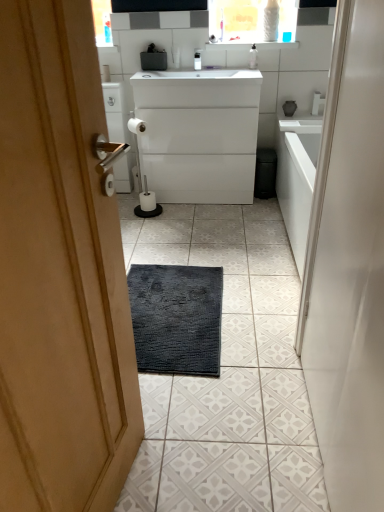
Question: Is transparent plastic bottle at upper center further to the viewer compared to white matte toilet paper at center, the 2th toilet paper from the top?

Choices:
 (A) no
 (B) yes

Answer: (A)

Question: Does transparent plastic bottle at upper center have a greater height compared to white matte toilet paper at center, which is counted as the 1th toilet paper, starting from the right?

Choices:
 (A) no
 (B) yes

Answer: (B)

Question: Is transparent plastic bottle at upper center not inside white matte toilet paper at center, arranged as the 2th toilet paper when viewed from the left?

Choices:
 (A) no
 (B) yes

Answer: (B)

Question: Is transparent plastic bottle at upper center bigger than white matte toilet paper at center, arranged as the 2th toilet paper when viewed from the left?

Choices:
 (A) yes
 (B) no

Answer: (B)

Question: Is transparent plastic bottle at upper center smaller than white matte toilet paper at center, the 2th toilet paper from the top?

Choices:
 (A) yes
 (B) no

Answer: (A)

Question: Is point (188, 83) positioned closer to the camera than point (104, 64)?

Choices:
 (A) farther
 (B) closer

Answer: (B)

Question: From the image's perspective, is white glossy cabinet at center positioned above or below white matte toilet paper at center, which is the second toilet paper from right to left?

Choices:
 (A) above
 (B) below

Answer: (B)

Question: Is white glossy cabinet at center to the left or to the right of white matte toilet paper at center, the 1th toilet paper from the left, in the image?

Choices:
 (A) right
 (B) left

Answer: (A)

Question: Considering the positions of white glossy cabinet at center and white matte toilet paper at center, which is the second toilet paper from right to left, in the image, is white glossy cabinet at center wider or thinner than white matte toilet paper at center, which is the second toilet paper from right to left,?

Choices:
 (A) wide
 (B) thin

Answer: (A)

Question: Relative to white matte toilet paper at center, which is counted as the 1th toilet paper, starting from the right, is white glossy cabinet at center in front or behind?

Choices:
 (A) front
 (B) behind

Answer: (A)

Question: Is point (178, 89) closer or farther from the camera than point (148, 190)?

Choices:
 (A) closer
 (B) farther

Answer: (A)

Question: From a real-world perspective, relative to white matte toilet paper at center, the 2th toilet paper from the top, is white glossy cabinet at center vertically above or below?

Choices:
 (A) above
 (B) below

Answer: (A)

Question: Looking at the image, does white glossy cabinet at center seem bigger or smaller compared to white matte toilet paper at center, the 2th toilet paper from the top?

Choices:
 (A) small
 (B) big

Answer: (B)

Question: In terms of height, does white matte toilet paper at center, the 2th toilet paper from the top, look taller or shorter compared to white glossy cabinet at center?

Choices:
 (A) tall
 (B) short

Answer: (B)

Question: From the image's perspective, is white matte toilet paper at center, which is counted as the 1th toilet paper, starting from the right, above or below white glossy cabinet at center?

Choices:
 (A) below
 (B) above

Answer: (A)